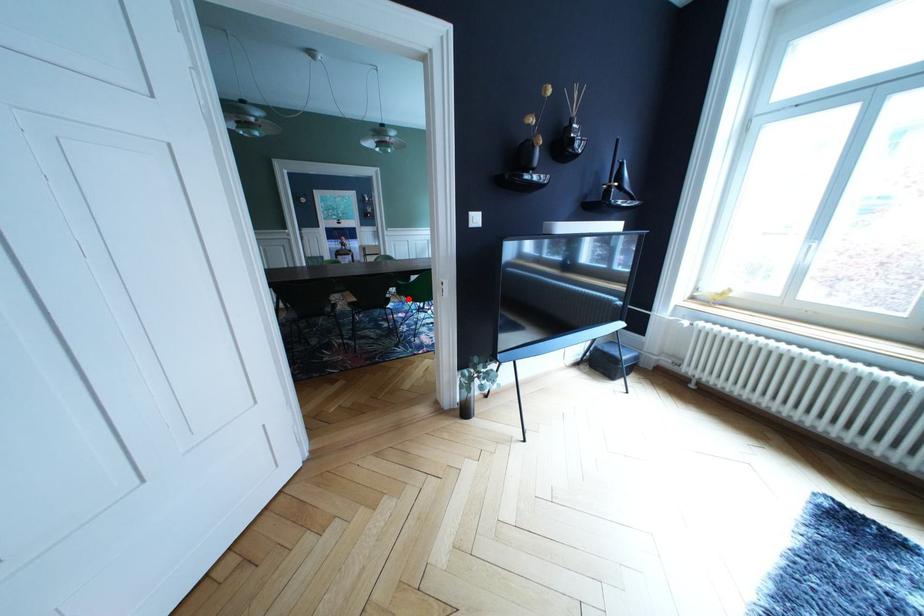
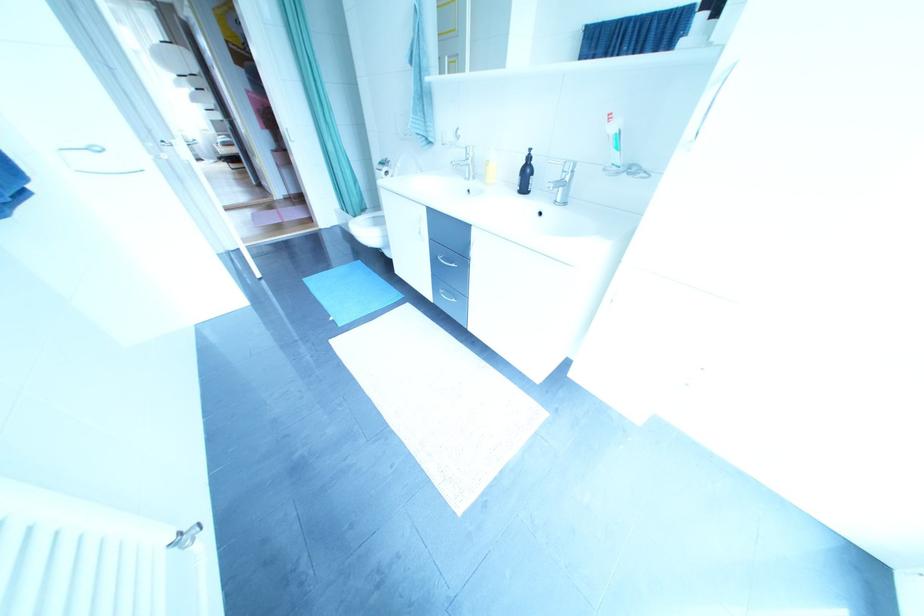
Question: I am providing you with two images of the same scene from different viewpoints. A red point is marked on the first image. At the location where the point appears in image 1, is it still visible in image 2?

Choices:
 (A) Yes
 (B) No

Answer: (B)